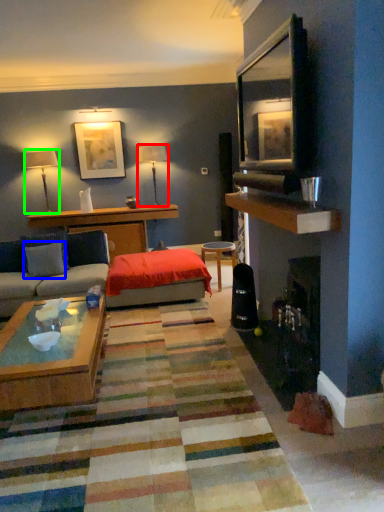
Question: Estimate the real-world distances between objects in this image. Which object is farther from lamp (highlighted by a red box), pillow (highlighted by a blue box) or lamp (highlighted by a green box)?

Choices:
 (A) pillow
 (B) lamp

Answer: (A)